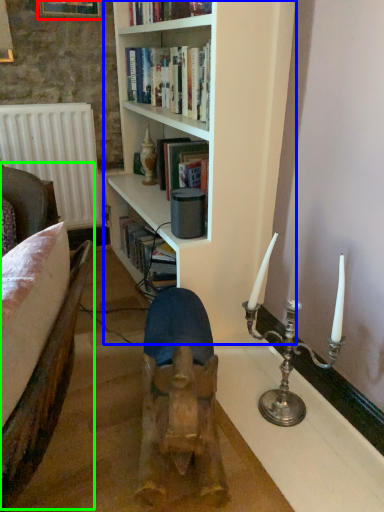
Question: Based on their relative distances, which object is nearer to picture frame (highlighted by a red box)? Choose from bookcase (highlighted by a blue box) and armchair (highlighted by a green box).

Choices:
 (A) bookcase
 (B) armchair

Answer: (A)